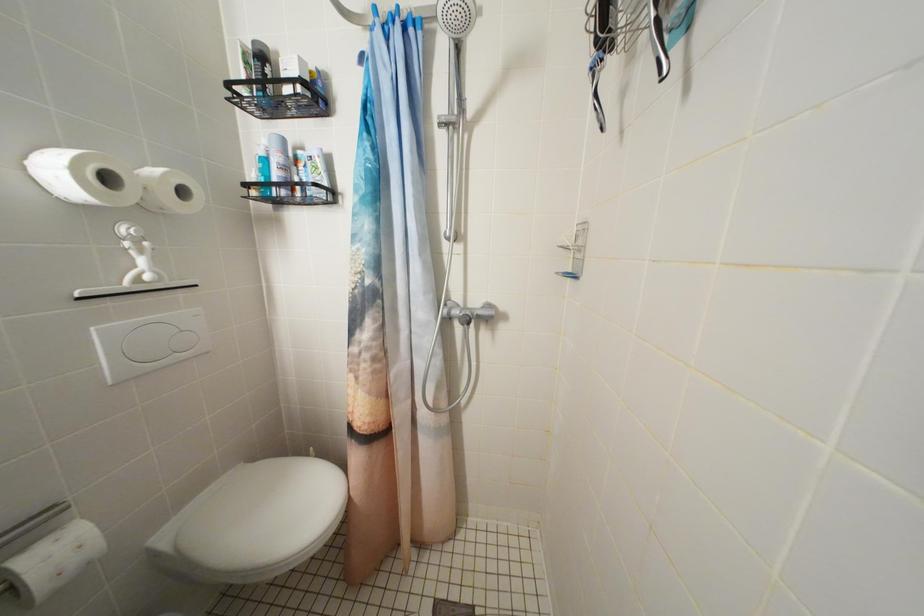
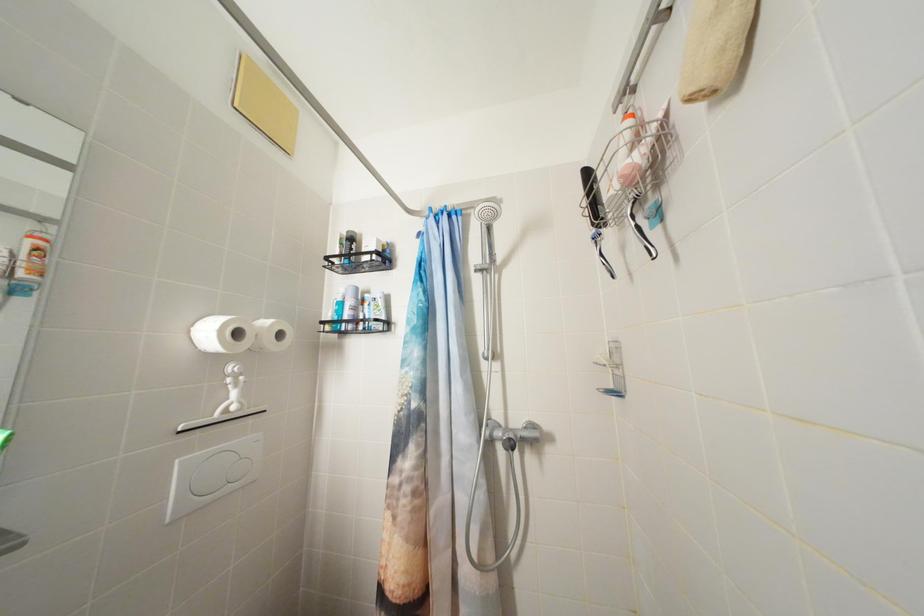
The images are taken continuously from a first-person perspective. In which direction are you moving?

The cameraman moved toward left, backward.